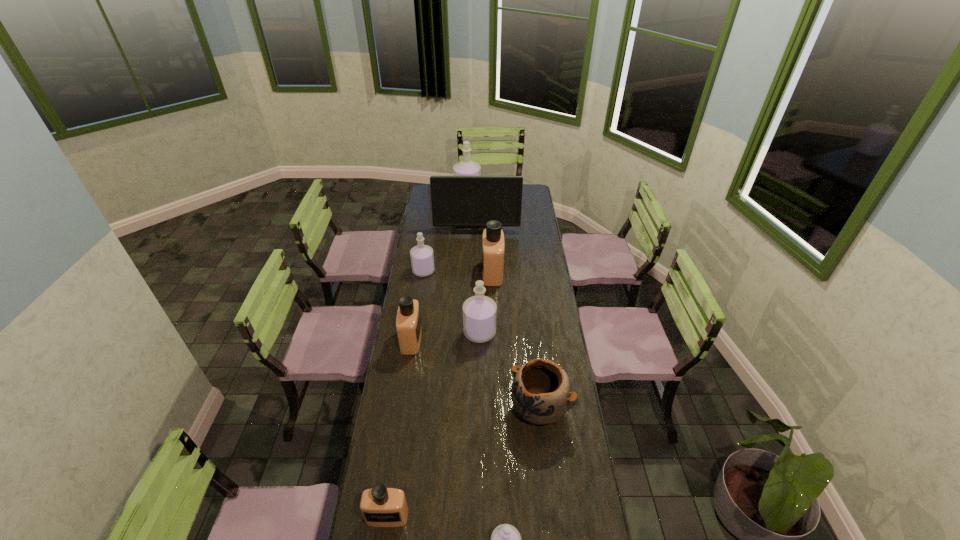
This screenshot has width=960, height=540. I want to click on the farthest purple perfume, so click(x=466, y=167).

Where is `the farthest object`? Image resolution: width=960 pixels, height=540 pixels. the farthest object is located at coordinates (466, 167).

Locate an element on the screen. the second farthest object is located at coordinates (457, 201).

This screenshot has width=960, height=540. I want to click on black computer monitor, so click(x=457, y=201).

I want to click on the rightmost beige perfume, so click(493, 247).

Find the location of a particular element. The height and width of the screenshot is (540, 960). the farthest beige perfume is located at coordinates (493, 247).

At what (x,y) coordinates should I click in order to perform the action: click on the second biggest purple perfume. Please return your answer as a coordinate pair (x, y). The image size is (960, 540). Looking at the image, I should click on (479, 312).

Identify the location of the third nearest purple perfume. (422, 259).

At what (x,y) coordinates should I click in order to perform the action: click on the leftmost purple perfume. Please return your answer as a coordinate pair (x, y). This screenshot has width=960, height=540. Looking at the image, I should click on (422, 259).

Identify the location of the second nearest beige perfume. This screenshot has height=540, width=960. (408, 321).